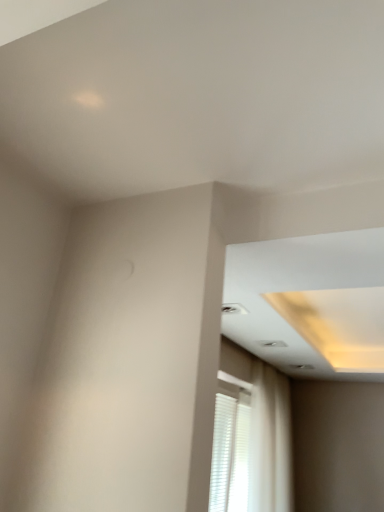
Question: From a real-world perspective, is white sheer curtain at lower right physically located above or below white matte blinds at lower right?

Choices:
 (A) above
 (B) below

Answer: (A)

Question: In terms of size, does white sheer curtain at lower right appear bigger or smaller than white matte blinds at lower right?

Choices:
 (A) big
 (B) small

Answer: (A)

Question: From their relative heights in the image, would you say white sheer curtain at lower right is taller or shorter than white matte blinds at lower right?

Choices:
 (A) tall
 (B) short

Answer: (A)

Question: Looking at the image, does white matte blinds at lower right seem bigger or smaller compared to white sheer curtain at lower right?

Choices:
 (A) small
 (B) big

Answer: (A)

Question: From a real-world perspective, is white matte blinds at lower right physically located above or below white sheer curtain at lower right?

Choices:
 (A) above
 (B) below

Answer: (B)

Question: In terms of width, does white matte blinds at lower right look wider or thinner when compared to white sheer curtain at lower right?

Choices:
 (A) thin
 (B) wide

Answer: (A)

Question: In the image, is white matte blinds at lower right positioned in front of or behind white sheer curtain at lower right?

Choices:
 (A) behind
 (B) front

Answer: (B)